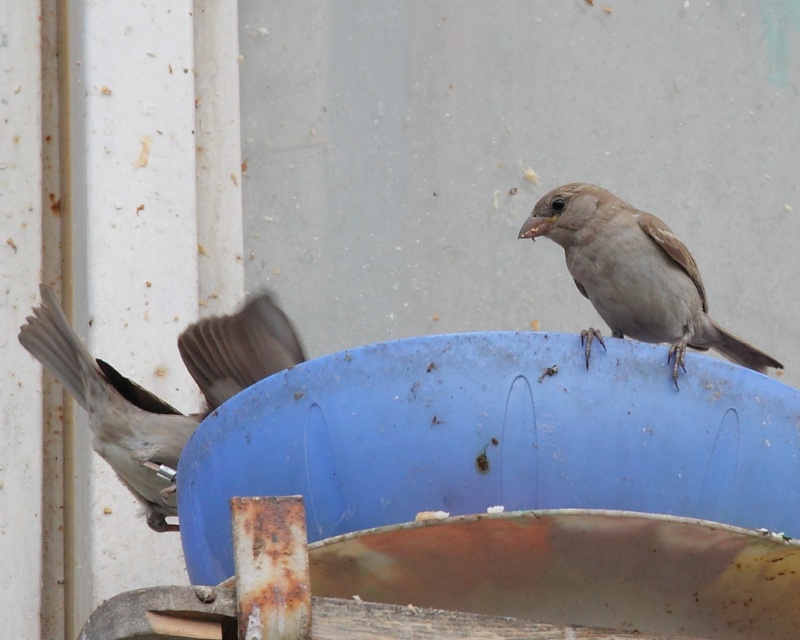
You are a birdwatcher observing two gray matte sparrows in the scene. Which sparrow, the gray matte sparrow at left or the gray matte sparrow at upper right, is positioned closer to you?

The gray matte sparrow at left is closer to the viewer than the gray matte sparrow at upper right.

You are a photographer aiming to capture a close shot of the gray matte sparrow at left. Given its current position at point 0.617, 0.194, where should you adjust your camera focus to ensure the bird is in sharp focus?

To ensure the gray matte sparrow at left is in sharp focus, adjust the camera focus to its exact position at point (154, 394).